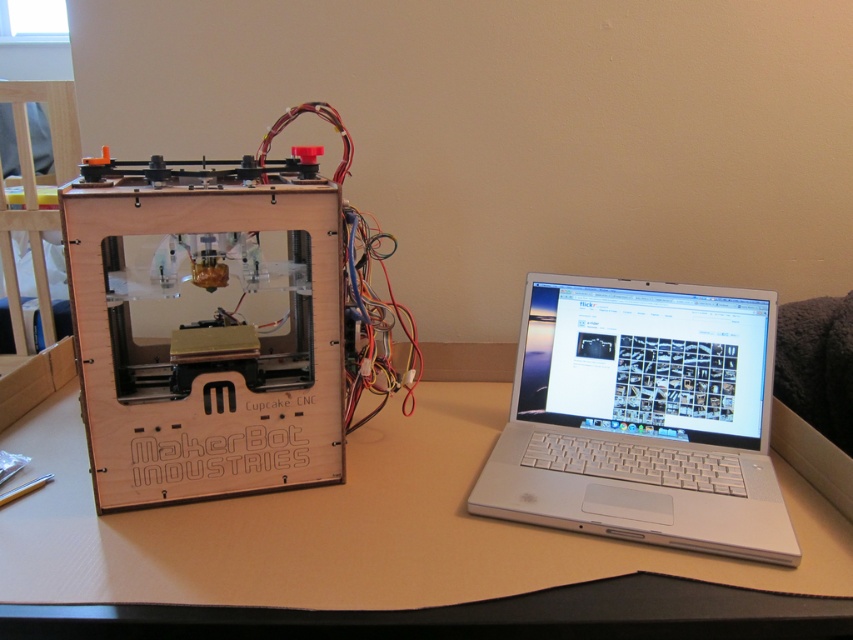
Is light brown wood table at center smaller than silver metallic laptop at center?

No.

Is light brown wood table at center below silver metallic laptop at center?

Indeed, light brown wood table at center is positioned under silver metallic laptop at center.

Image resolution: width=853 pixels, height=640 pixels. What are the coordinates of `light brown wood table at center` in the screenshot? It's located at (413, 561).

Locate an element on the screen. This screenshot has width=853, height=640. light brown wood table at center is located at coordinates (413, 561).